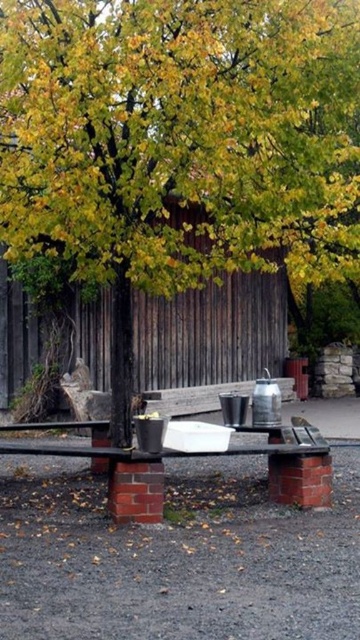
You are standing at the edge of a path leading to the wooden bench at center. To your left, there is a fence blocking your view. Can you see the green leafy tree at center from your current position?

Yes, you can see the green leafy tree at center because it is positioned to the right of the wooden bench at center, which is not blocked by the fence on your left side.

In the scene shown: You are standing in the outdoor scene and want to sit on the smooth wooden bench at center. To your right, there is a path leading away from the green leafy tree at center. Which direction should you walk to reach the path?

The green leafy tree at center is to the left of the smooth wooden bench at center. Since the path is to the right of the tree, you should walk towards the right side of the bench to reach the path.